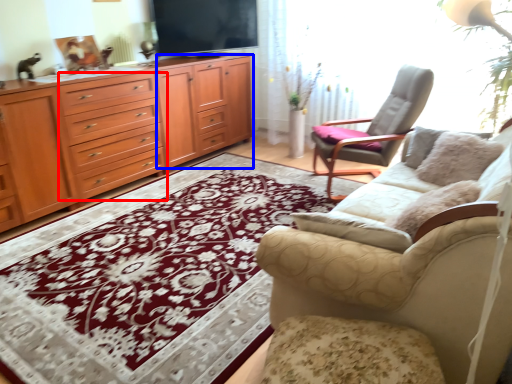
Question: Which point is further to the camera, drawer (highlighted by a red box) or tv cabinet (highlighted by a blue box)?

Choices:
 (A) drawer
 (B) tv cabinet

Answer: (B)